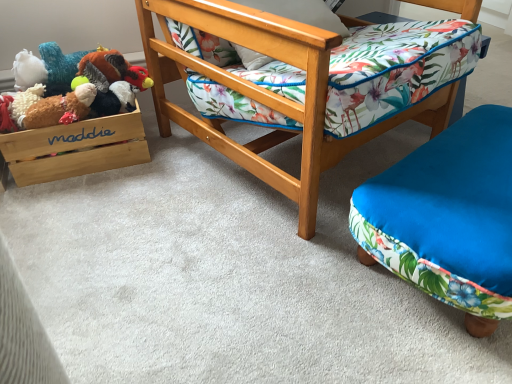
What are the coordinates of `vacant region in front of wooden/matte storage box at left` in the screenshot? It's located at (86, 210).